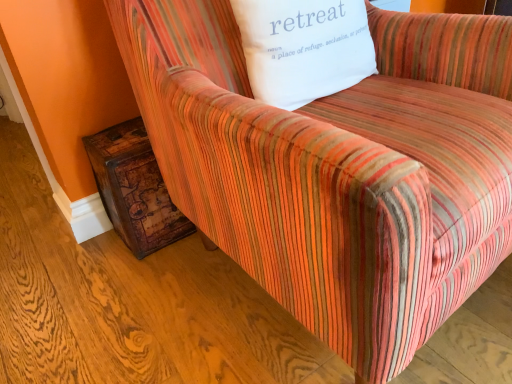
At what (x,y) coordinates should I click in order to perform the action: click on free point in front of rustic wood side table at lower left. Please return your answer as a coordinate pair (x, y). The width and height of the screenshot is (512, 384). Looking at the image, I should click on (130, 276).